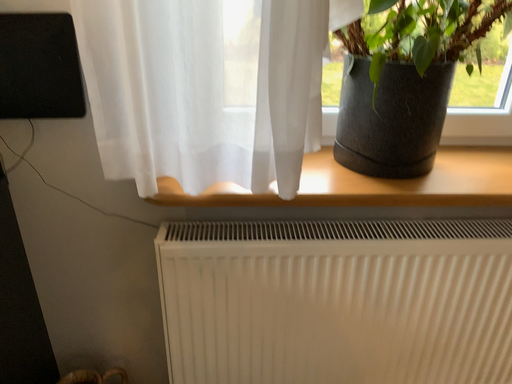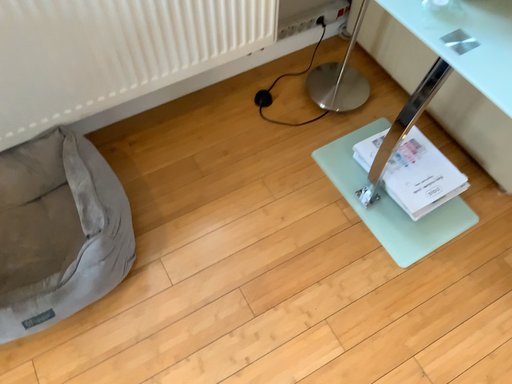
Question: Which way did the camera rotate in the video?

Choices:
 (A) rotated downward
 (B) rotated upward

Answer: (A)